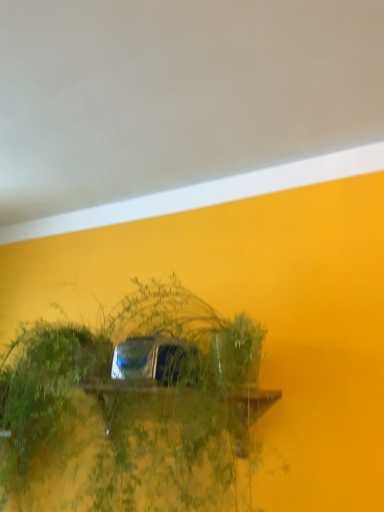
The height and width of the screenshot is (512, 384). What are the coordinates of `green leafy plant at center` in the screenshot? It's located at (134, 409).

This screenshot has height=512, width=384. Describe the element at coordinates (134, 409) in the screenshot. I see `green leafy plant at center` at that location.

Image resolution: width=384 pixels, height=512 pixels. What do you see at coordinates (176, 94) in the screenshot?
I see `matte yellow wall at upper center` at bounding box center [176, 94].

I want to click on matte yellow wall at upper center, so click(x=176, y=94).

Where is `green leafy plant at center`? This screenshot has width=384, height=512. green leafy plant at center is located at coordinates (134, 409).

Based on the photo, considering the positions of objects green leafy plant at center and matte yellow wall at upper center in the image provided, who is more to the left, green leafy plant at center or matte yellow wall at upper center?

matte yellow wall at upper center.

In the scene shown: Is green leafy plant at center in front of or behind matte yellow wall at upper center in the image?

Clearly, green leafy plant at center is behind matte yellow wall at upper center.

Which point is more distant from viewer, (155, 408) or (192, 23)?

The point (155, 408) is behind.

From the image's perspective, would you say green leafy plant at center is shown under matte yellow wall at upper center?

Yes, from the image's perspective, green leafy plant at center is below matte yellow wall at upper center.

From a real-world perspective, does green leafy plant at center sit lower than matte yellow wall at upper center?

Yes.

Can you confirm if green leafy plant at center is wider than matte yellow wall at upper center?

No, green leafy plant at center is not wider than matte yellow wall at upper center.

Consider the image. Is green leafy plant at center taller or shorter than matte yellow wall at upper center?

In the image, green leafy plant at center appears to be taller than matte yellow wall at upper center.

In terms of size, does green leafy plant at center appear bigger or smaller than matte yellow wall at upper center?

Clearly, green leafy plant at center is larger in size than matte yellow wall at upper center.

Is matte yellow wall at upper center inside green leafy plant at center?

No.

Is green leafy plant at center with matte yellow wall at upper center?

No, green leafy plant at center is not next to matte yellow wall at upper center.

Does green leafy plant at center turn towards matte yellow wall at upper center?

No, green leafy plant at center does not turn towards matte yellow wall at upper center.

How many degrees apart are the facing directions of green leafy plant at center and matte yellow wall at upper center?

They differ by 179 degrees in their facing directions.

Find the location of a particular element. This screenshot has width=384, height=512. houseplant lying behind the matte yellow wall at upper center is located at coordinates (134, 409).

Considering the positions of objects matte yellow wall at upper center and green leafy plant at center in the image provided, who is more to the right, matte yellow wall at upper center or green leafy plant at center?

Positioned to the right is green leafy plant at center.

Considering the positions of objects matte yellow wall at upper center and green leafy plant at center in the image provided, who is behind, matte yellow wall at upper center or green leafy plant at center?

green leafy plant at center.

Between point (325, 62) and point (7, 471), which one is positioned behind?

The point (7, 471) is farther.

In the scene shown: From the image's perspective, between matte yellow wall at upper center and green leafy plant at center, who is located below?

green leafy plant at center.

From a real-world perspective, is matte yellow wall at upper center beneath green leafy plant at center?

Actually, matte yellow wall at upper center is physically above green leafy plant at center in the real world.

Considering the relative sizes of matte yellow wall at upper center and green leafy plant at center in the image provided, is matte yellow wall at upper center wider than green leafy plant at center?

Correct, the width of matte yellow wall at upper center exceeds that of green leafy plant at center.

Between matte yellow wall at upper center and green leafy plant at center, which one has more height?

With more height is green leafy plant at center.

Is matte yellow wall at upper center smaller than green leafy plant at center?

Yes.

From the picture: Is matte yellow wall at upper center spatially inside green leafy plant at center, or outside of it?

matte yellow wall at upper center lies outside green leafy plant at center.

Is matte yellow wall at upper center not near green leafy plant at center?

No, matte yellow wall at upper center is not far away from green leafy plant at center.

Is matte yellow wall at upper center oriented away from green leafy plant at center?

No, matte yellow wall at upper center's orientation is not away from green leafy plant at center.

What's the angular difference between matte yellow wall at upper center and green leafy plant at center's facing directions?

179 degrees.

The image size is (384, 512). What are the coordinates of `houseplant below the matte yellow wall at upper center (from a real-world perspective)` in the screenshot? It's located at (134, 409).

Find the location of a particular element. houseplant lying on the right of matte yellow wall at upper center is located at coordinates (134, 409).

Identify the location of houseplant behind the matte yellow wall at upper center. The height and width of the screenshot is (512, 384). (134, 409).